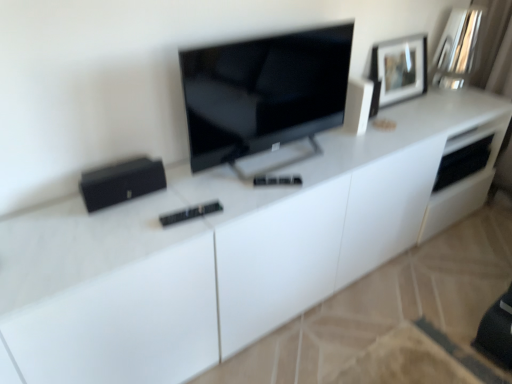
In order to face white glossy speaker at upper right, the first appliance from the back, should I rotate leftwards or rightwards?

To face it directly, rotate right by 13.041 degrees.

Image resolution: width=512 pixels, height=384 pixels. I want to click on black matte speaker at left, positioned as the first appliance in bottom-to-top order, so click(121, 182).

The image size is (512, 384). What do you see at coordinates (398, 70) in the screenshot? I see `matte black picture frame at upper right` at bounding box center [398, 70].

In order to face matte black tv at center, should I rotate leftwards or rightwards?

Rotate your view right by about 3.544°.

The height and width of the screenshot is (384, 512). I want to click on matte black tv at center, so click(264, 92).

The height and width of the screenshot is (384, 512). I want to click on white glossy speaker at upper right, the first appliance from the right, so click(358, 105).

In the scene shown: Is matte black picture frame at upper right directly adjacent to black matte speaker at left, placed as the first appliance when sorted from front to back?

No, matte black picture frame at upper right is not next to black matte speaker at left, placed as the first appliance when sorted from front to back.

Is black matte speaker at left, the 2th appliance viewed from the top, surrounded by matte black picture frame at upper right?

Definitely not — black matte speaker at left, the 2th appliance viewed from the top, is not inside matte black picture frame at upper right.

Considering the relative sizes of matte black picture frame at upper right and black matte speaker at left, the 2th appliance viewed from the top, in the image provided, is matte black picture frame at upper right thinner than black matte speaker at left, the 2th appliance viewed from the top,?

Correct, the width of matte black picture frame at upper right is less than that of black matte speaker at left, the 2th appliance viewed from the top.

From the image's perspective, is matte black picture frame at upper right above black matte speaker at left, placed as the 1th appliance when sorted from left to right?

Yes.

From a real-world perspective, is matte black tv at center physically above black matte speaker at left, the 2th appliance from the right?

Yes, from a real-world perspective, matte black tv at center is above black matte speaker at left, the 2th appliance from the right.

Is black matte speaker at left, placed as the 1th appliance when sorted from left to right, at the back of matte black tv at center?

No, matte black tv at center's orientation is not away from black matte speaker at left, placed as the 1th appliance when sorted from left to right.

Find the location of a particular element. This screenshot has width=512, height=384. appliance located below the matte black tv at center (from the image's perspective) is located at coordinates (121, 182).

Is white glossy speaker at upper right, which appears as the 2th appliance when ordered from the bottom, positioned beyond the bounds of matte black picture frame at upper right?

Absolutely, white glossy speaker at upper right, which appears as the 2th appliance when ordered from the bottom, is external to matte black picture frame at upper right.

Is white glossy speaker at upper right, the first appliance from the right, shorter than matte black picture frame at upper right?

Correct, white glossy speaker at upper right, the first appliance from the right, is not as tall as matte black picture frame at upper right.

Measure the distance from white glossy speaker at upper right, which is counted as the 1th appliance, starting from the top, to matte black picture frame at upper right.

A: white glossy speaker at upper right, which is counted as the 1th appliance, starting from the top, and matte black picture frame at upper right are 14.95 inches apart from each other.

From the image's perspective, is white glossy speaker at upper right, the first appliance from the back, above or below matte black picture frame at upper right?

white glossy speaker at upper right, the first appliance from the back, is below matte black picture frame at upper right.

Is black matte speaker at left, placed as the first appliance when sorted from front to back, facing towards matte black picture frame at upper right?

No.

In the scene shown: Is black matte speaker at left, the 2th appliance from the right, wider or thinner than matte black picture frame at upper right?

In the image, black matte speaker at left, the 2th appliance from the right, appears to be wider than matte black picture frame at upper right.

Is black matte speaker at left, placed as the 1th appliance when sorted from left to right, outside of matte black picture frame at upper right?

That's correct, black matte speaker at left, placed as the 1th appliance when sorted from left to right, is outside of matte black picture frame at upper right.

How many degrees apart are the facing directions of black matte speaker at left, the 2th appliance from the right, and matte black picture frame at upper right?

0.000246 degrees.

Locate an element on the screen. This screenshot has height=384, width=512. appliance on the right of matte black tv at center is located at coordinates (358, 105).

From the picture: Is the position of white glossy speaker at upper right, marked as the 2th appliance in a front-to-back arrangement, more distant than that of matte black tv at center?

Yes, white glossy speaker at upper right, marked as the 2th appliance in a front-to-back arrangement, is further from the viewer.

From the image's perspective, is white glossy speaker at upper right, the 2th appliance from the left, located beneath matte black tv at center?

No.

Could you measure the distance between white glossy speaker at upper right, the first appliance from the back, and matte black tv at center?

The distance of white glossy speaker at upper right, the first appliance from the back, from matte black tv at center is 14.53 inches.

Identify the location of appliance lying in front of the white glossy speaker at upper right, which is counted as the 1th appliance, starting from the top. (121, 182).

Is white glossy speaker at upper right, the first appliance from the right, completely or partially outside of black matte speaker at left, positioned as the first appliance in bottom-to-top order?

Yes.

Between white glossy speaker at upper right, which appears as the 2th appliance when ordered from the bottom, and black matte speaker at left, the 2th appliance viewed from the top, which one has larger width?

white glossy speaker at upper right, which appears as the 2th appliance when ordered from the bottom.

Considering the relative sizes of white glossy speaker at upper right, marked as the 2th appliance in a front-to-back arrangement, and black matte speaker at left, placed as the 1th appliance when sorted from left to right, in the image provided, is white glossy speaker at upper right, marked as the 2th appliance in a front-to-back arrangement, shorter than black matte speaker at left, placed as the 1th appliance when sorted from left to right,?

Incorrect, the height of white glossy speaker at upper right, marked as the 2th appliance in a front-to-back arrangement, does not fall short of that of black matte speaker at left, placed as the 1th appliance when sorted from left to right.

Does black matte speaker at left, the 2th appliance viewed from the top, have a greater height compared to white glossy speaker at upper right, which appears as the 2th appliance when ordered from the bottom?

Incorrect, the height of black matte speaker at left, the 2th appliance viewed from the top, is not larger of that of white glossy speaker at upper right, which appears as the 2th appliance when ordered from the bottom.

Is black matte speaker at left, placed as the first appliance when sorted from front to back, oriented towards white glossy speaker at upper right, which appears as the 2th appliance when ordered from the bottom?

No, black matte speaker at left, placed as the first appliance when sorted from front to back, is not aimed at white glossy speaker at upper right, which appears as the 2th appliance when ordered from the bottom.

Which of these two, black matte speaker at left, placed as the first appliance when sorted from front to back, or white glossy speaker at upper right, marked as the 2th appliance in a front-to-back arrangement, is wider?

white glossy speaker at upper right, marked as the 2th appliance in a front-to-back arrangement, is wider.

Is black matte speaker at left, the 2th appliance viewed from the top, bigger or smaller than white glossy speaker at upper right, the first appliance from the back?

In the image, black matte speaker at left, the 2th appliance viewed from the top, appears to be larger than white glossy speaker at upper right, the first appliance from the back.

Where is `the 2nd appliance in front of the matte black picture frame at upper right`? the 2nd appliance in front of the matte black picture frame at upper right is located at coordinates (121, 182).

This screenshot has width=512, height=384. In the image, there is a black matte speaker at left, the 2th appliance from the right. In order to click on television above it (from the image's perspective) in this screenshot , I will do `click(264, 92)`.

Based on their spatial positions, is black matte speaker at left, the 2th appliance from the right, or white glossy speaker at upper right, which is counted as the 1th appliance, starting from the top, further from matte black picture frame at upper right?

black matte speaker at left, the 2th appliance from the right, lies further to matte black picture frame at upper right than the other object.

Estimate the real-world distances between objects in this image. Which object is closer to white glossy speaker at upper right, the first appliance from the right, matte black picture frame at upper right or black matte speaker at left, the 2th appliance from the right?

The object closer to white glossy speaker at upper right, the first appliance from the right, is matte black picture frame at upper right.

Considering their positions, is white glossy speaker at upper right, the 2th appliance from the left, positioned further to matte black tv at center than black matte speaker at left, placed as the first appliance when sorted from front to back?

black matte speaker at left, placed as the first appliance when sorted from front to back, is positioned further to the anchor matte black tv at center.

Looking at the image, which one is located closer to matte black tv at center, matte black picture frame at upper right or white glossy speaker at upper right, the first appliance from the back?

white glossy speaker at upper right, the first appliance from the back, is positioned closer to the anchor matte black tv at center.

Consider the image. When comparing their distances from white glossy speaker at upper right, which is counted as the 1th appliance, starting from the top, does black matte speaker at left, positioned as the first appliance in bottom-to-top order, or matte black tv at center seem closer?

matte black tv at center lies closer to white glossy speaker at upper right, which is counted as the 1th appliance, starting from the top, than the other object.

Based on their spatial positions, is black matte speaker at left, positioned as the second appliance in back-to-front order, or matte black picture frame at upper right further from matte black tv at center?

The object further to matte black tv at center is matte black picture frame at upper right.

Based on their spatial positions, is matte black tv at center or matte black picture frame at upper right further from black matte speaker at left, positioned as the first appliance in bottom-to-top order?

Based on the image, matte black picture frame at upper right appears to be further to black matte speaker at left, positioned as the first appliance in bottom-to-top order.

Estimate the real-world distances between objects in this image. Which object is further from black matte speaker at left, the 2th appliance from the right, white glossy speaker at upper right, which appears as the 2th appliance when ordered from the bottom, or matte black tv at center?

white glossy speaker at upper right, which appears as the 2th appliance when ordered from the bottom, is positioned further to the anchor black matte speaker at left, the 2th appliance from the right.

The width and height of the screenshot is (512, 384). I want to click on television between black matte speaker at left, placed as the 1th appliance when sorted from left to right, and white glossy speaker at upper right, the first appliance from the back, from left to right, so click(x=264, y=92).

Where is `appliance located between black matte speaker at left, positioned as the second appliance in back-to-front order, and matte black picture frame at upper right in the left-right direction`? appliance located between black matte speaker at left, positioned as the second appliance in back-to-front order, and matte black picture frame at upper right in the left-right direction is located at coordinates (358, 105).

In order to click on television situated between black matte speaker at left, placed as the first appliance when sorted from front to back, and matte black picture frame at upper right from left to right in this screenshot , I will do `click(264, 92)`.